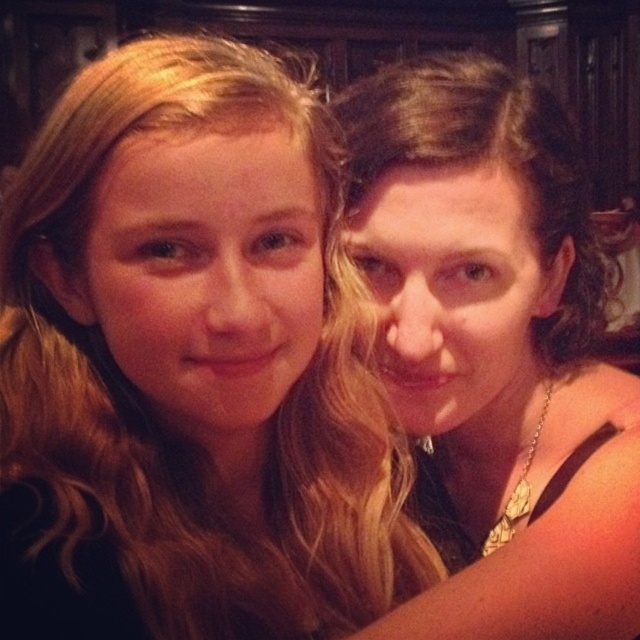
Is blonde hair at center wider than matte gold necklace at upper right?

In fact, blonde hair at center might be narrower than matte gold necklace at upper right.

Is blonde hair at center bigger than matte gold necklace at upper right?

Incorrect, blonde hair at center is not larger than matte gold necklace at upper right.

Is point (332, 620) farther from viewer compared to point (438, 209)?

No, it is in front of (438, 209).

You are a GUI agent. You are given a task and a screenshot of the screen. Output one action in this format:
    pyautogui.click(x=<x>, y=<y>)
    Task: Click on the blonde hair at center
    The image size is (640, 640).
    Given the screenshot: What is the action you would take?
    pyautogui.click(x=192, y=365)